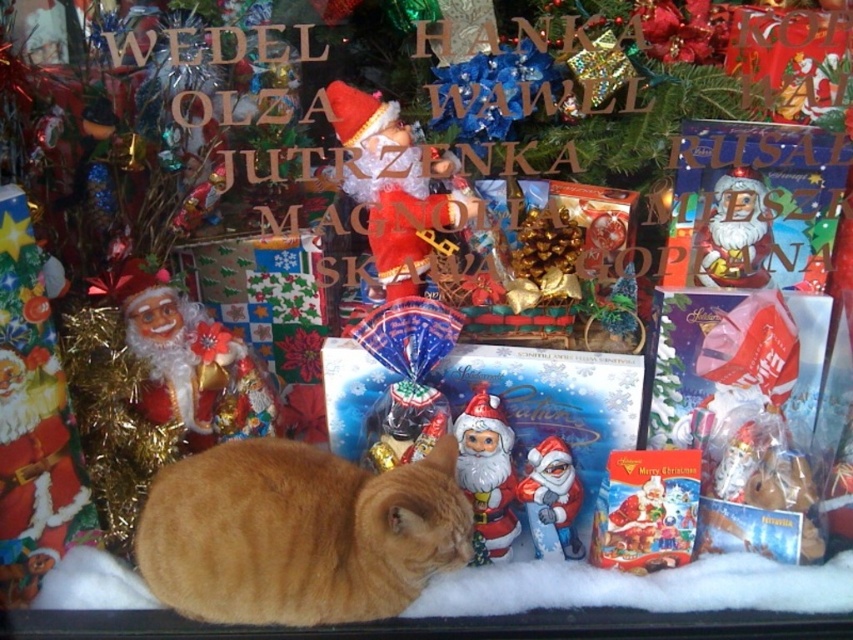
You are a delivery person who needs to place a new ornament box that is 18 centimeters wide between the black glass at lower center and the matte cardboard box at center. Based on the scene description, will there be enough space to fit the ornament box between them?

The distance between the black glass at lower center and the matte cardboard box at center is 16.68 centimeters. Since the ornament box is 18 centimeters wide, it will not fit in the available space.

You are a delivery robot trying to navigate to the shop entrance located at the top right corner of the scene. There is an orange fur cat at lower center in your path. Based on its coordinates, can you determine if the cat is blocking your direct path to the entrance?

The orange fur cat at lower center is located at coordinates point (299, 532), which is near the lower right area of the scene. Since the shop entrance is at the top right corner, the cat is not directly blocking the path to the entrance. However, the robot should still proceed with caution to avoid the cat.